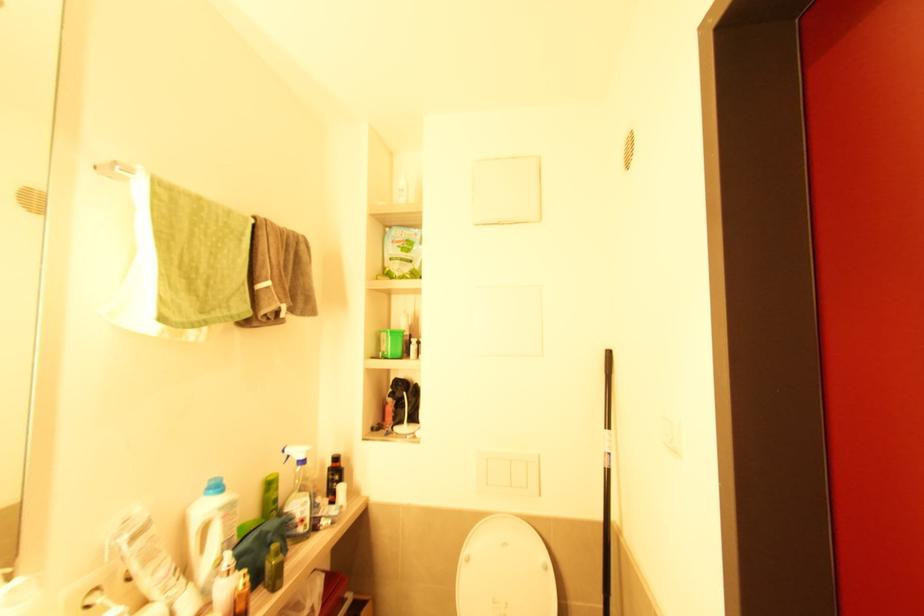
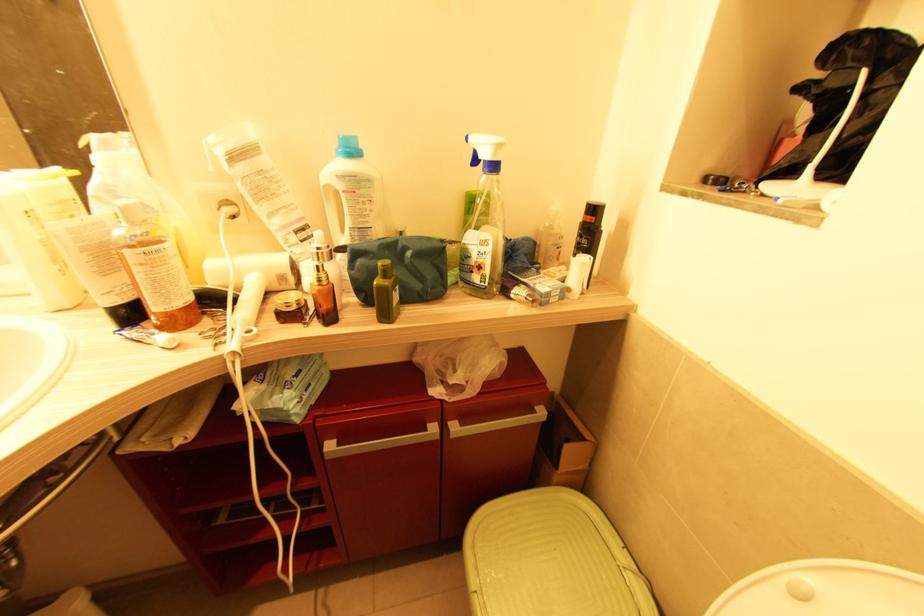
In the second image, find the point that corresponds to the point at 212,490 in the first image.

(341, 148)